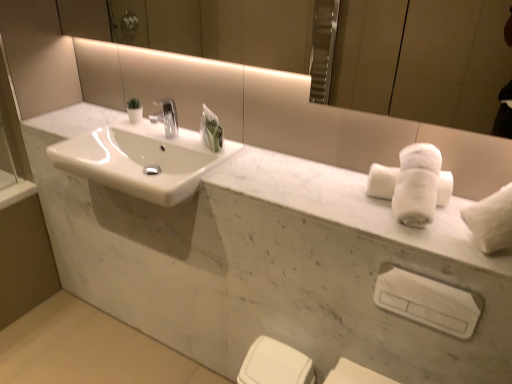
Locate an element on the screen. vacant region above smooth concrete floor at lower left (from a real-world perspective) is located at coordinates (82, 350).